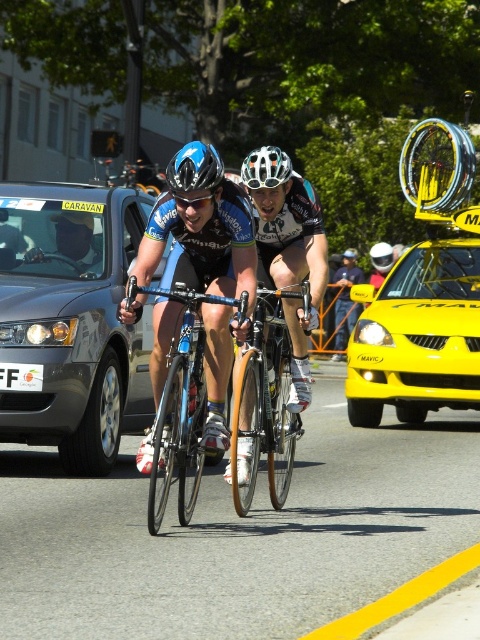
You are a cyclist participating in a race and need to quickly pass through an area where a yellow matte taxi at center is parked. The shiny blue bicycle at center is also present. Considering their widths, which vehicle should you avoid to ensure a safer passage?

The yellow matte taxi at center might be wider than the shiny blue bicycle at center, so to ensure a safer passage, you should avoid the yellow matte taxi at center and choose the path near the shiny blue bicycle at center instead.

You are a cyclist in a race and you need to reach the yellow matte taxi at center as quickly as possible. Which direction should you turn to reach it?

The yellow matte taxi at center is located at point coordinates of (423,292). Since the cyclists are in the foreground, they should turn towards the center of the image to reach the yellow matte taxi at center quickly.